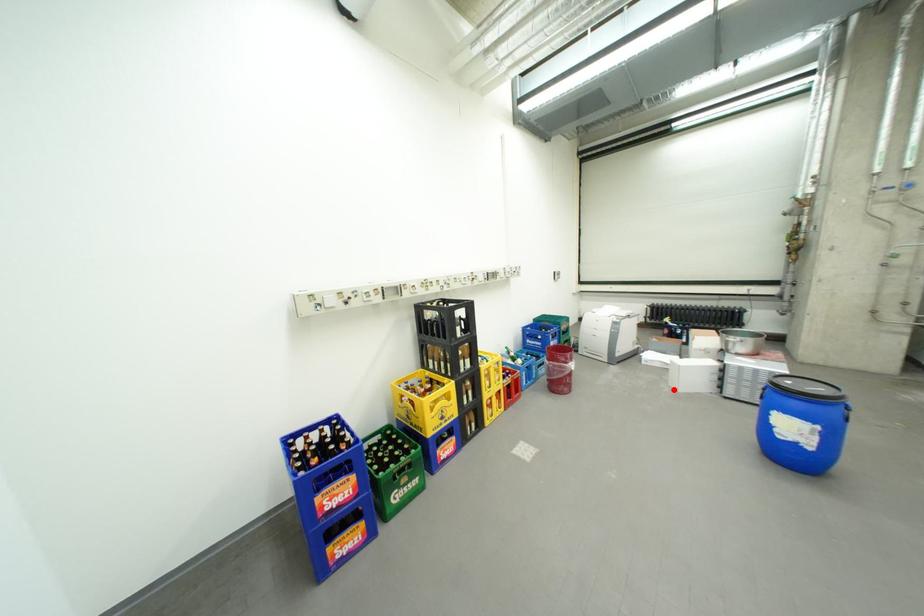
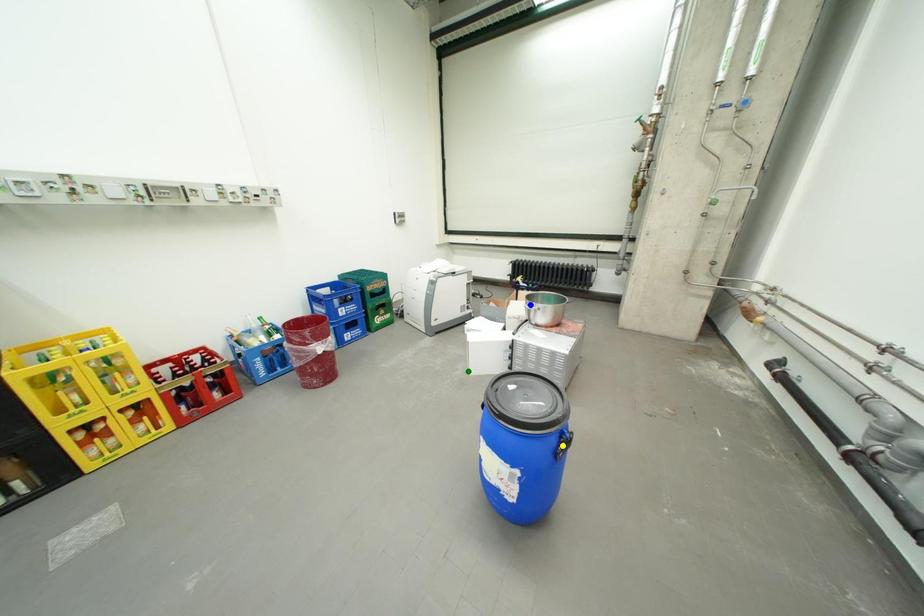
Question: I am providing you with two images of the same scene from different viewpoints. A red point is marked on the first image. You are given multiple points on the second image. In image 2, which mark is for the same physical point as the one in image 1?

Choices:
 (A) blue point
 (B) yellow point
 (C) green point

Answer: (C)